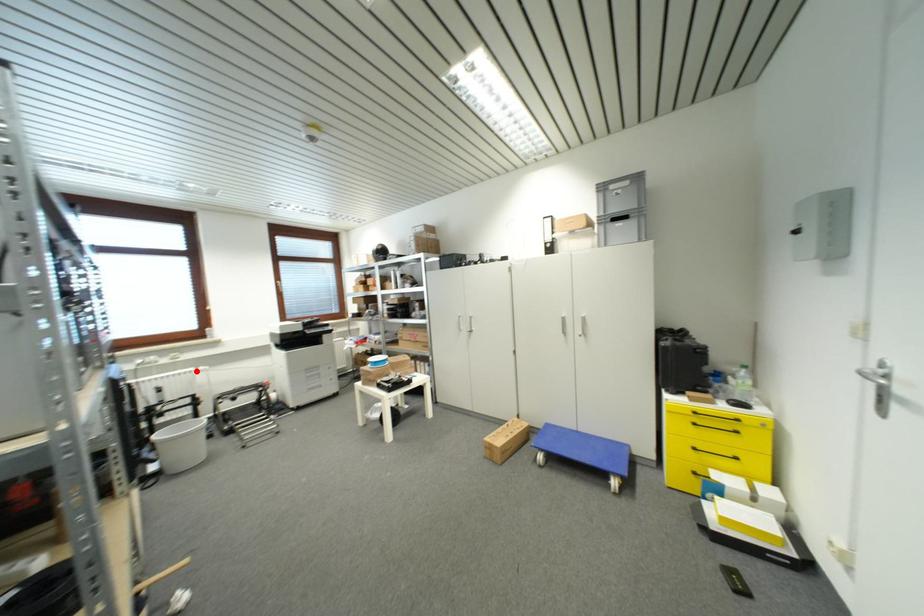
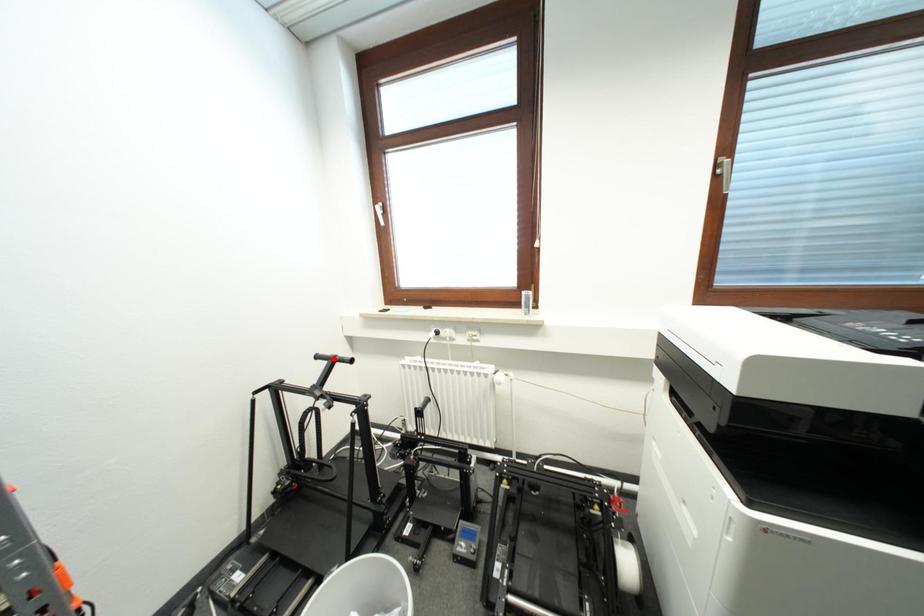
I am providing you with two images of the same scene from different viewpoints. A red point is marked on the first image and another point is marked on the second image. Do the highlighted points in image1 and image2 indicate the same real-world spot?

No